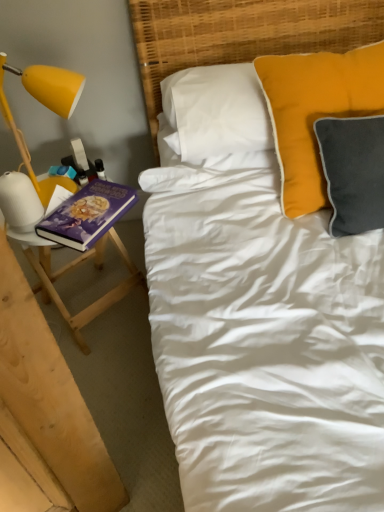
Locate an element on the screen. This screenshot has width=384, height=512. empty space that is ontop of purple matte book at left (from a real-world perspective) is located at coordinates (84, 207).